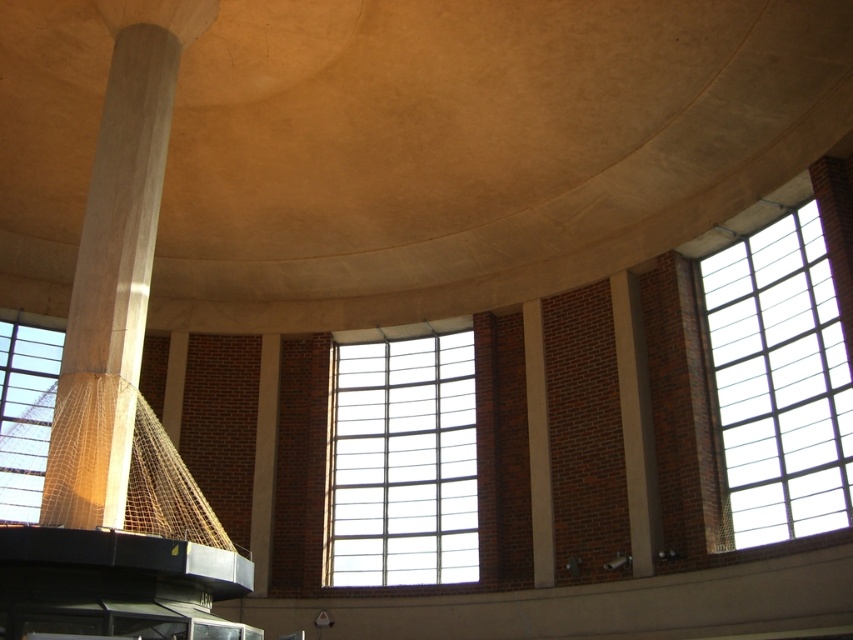
You are standing at the entrance of this modern space and see two points marked on the floor. The first point is at location point (x=375, y=529) and the second is at point (x=22, y=472). If you want to walk directly to the first point without passing through the second, which direction should you move relative to the second point?

To reach point (x=375, y=529) without passing through point (x=22, y=472), you should move in a direction that is behind the second point since point (x=375, y=529) is located behind point (x=22, y=472) according to the spatial description.

You are standing in the center of the room and want to find the best spot to take a photo that includes both the smooth concrete pillar at left and the clear glass window at right. Which object should you position yourself closer to in order to capture both in the same frame?

To capture both the smooth concrete pillar at left and the clear glass window at right in the same frame, you should position yourself closer to the clear glass window at right since the smooth concrete pillar at left is located above it.

You are standing in the middle of the room and want to exit through the nearest clear glass window. Which window should you head towards, the clear glass window at center or the clear glass window at left?

The clear glass window at left is closer to your current position since you are in the middle of the room and the clear glass window at center is to the right of the clear glass window at left. Therefore, you should head towards the clear glass window at left.